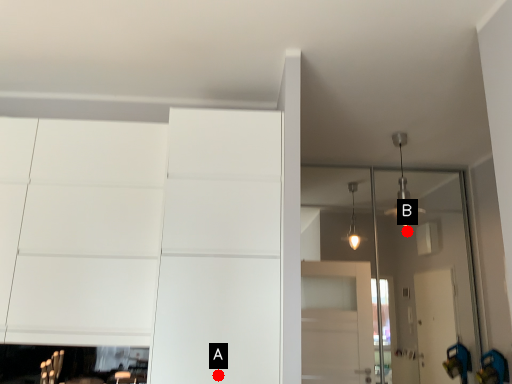
Question: Two points are circled on the image, labeled by A and B beside each circle. Among these points, which one is nearest to the camera?

Choices:
 (A) A is closer
 (B) B is closer

Answer: (A)